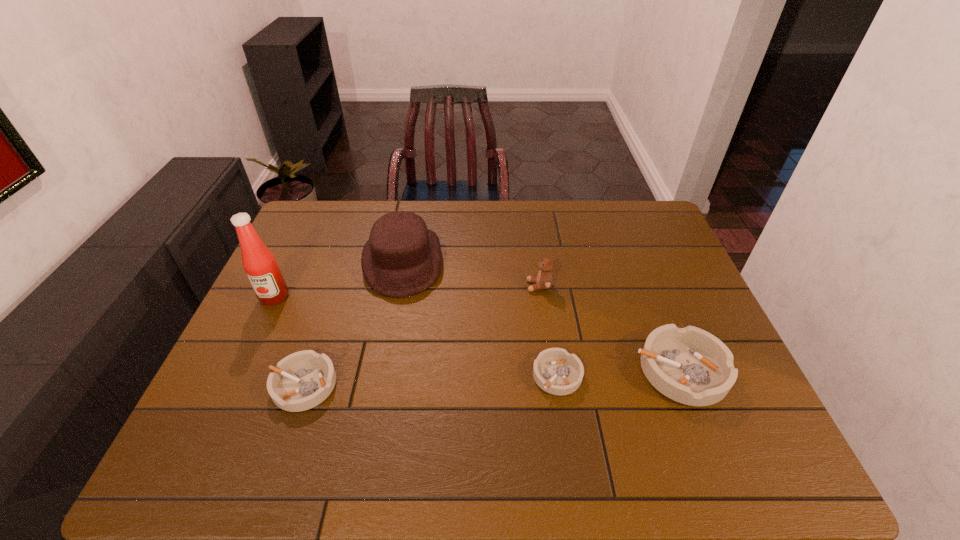
Where is `the leftmost ashtray`? The image size is (960, 540). the leftmost ashtray is located at coordinates (302, 380).

Where is `the second tallest ashtray`? This screenshot has width=960, height=540. the second tallest ashtray is located at coordinates (302, 380).

Identify the location of the shortest ashtray. (555, 371).

The width and height of the screenshot is (960, 540). Find the location of `the second ashtray from right to left`. the second ashtray from right to left is located at coordinates (555, 371).

What are the coordinates of `the rightmost object` in the screenshot? It's located at (689, 365).

Locate an element on the screen. the tallest ashtray is located at coordinates (689, 365).

The width and height of the screenshot is (960, 540). Find the location of `hat`. hat is located at coordinates (402, 258).

Locate an element on the screen. The image size is (960, 540). teddy bear is located at coordinates (544, 280).

Locate an element on the screen. This screenshot has height=540, width=960. the tallest object is located at coordinates pos(260,265).

This screenshot has height=540, width=960. I want to click on the leftmost object, so click(260, 265).